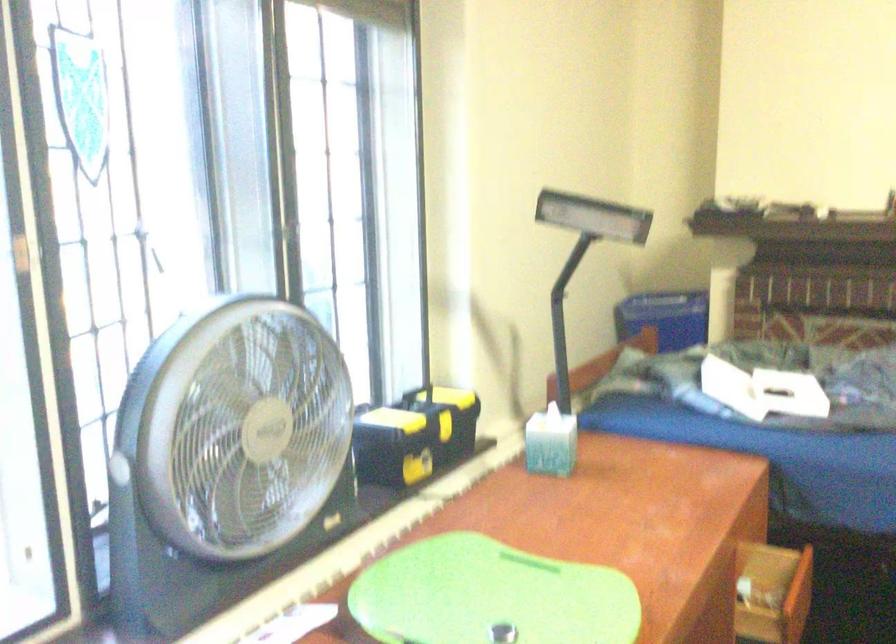
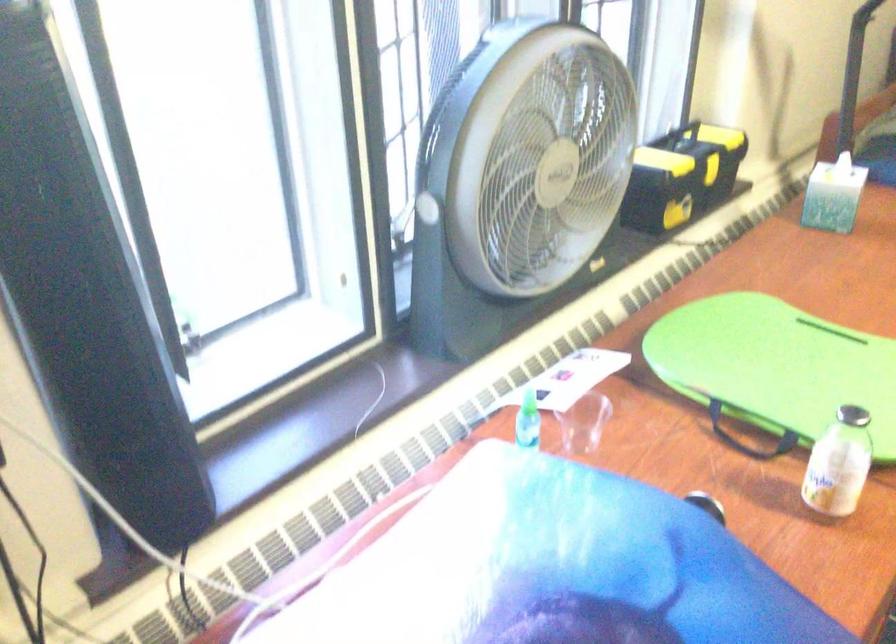
Question: Which direction would the cameraman need to move to produce the second image? Reply with the corresponding letter.

Choices:
 (A) Left
 (B) Right
 (C) Forward
 (D) Backward

Answer: (A)